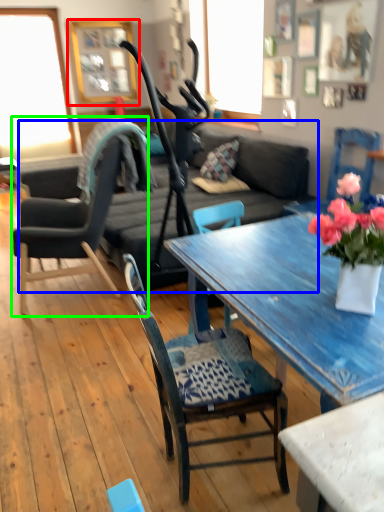
Question: Estimate the real-world distances between objects in this image. Which object is closer to picture frame (highlighted by a red box), studio couch (highlighted by a blue box) or chair (highlighted by a green box)?

Choices:
 (A) studio couch
 (B) chair

Answer: (A)